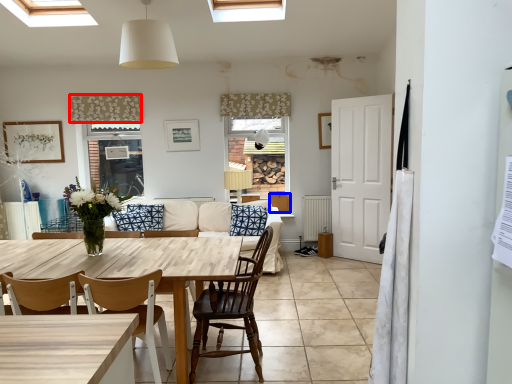
Question: Among these objects, which one is farthest to the camera, curtain (highlighted by a red box) or cabinetry (highlighted by a blue box)?

Choices:
 (A) curtain
 (B) cabinetry

Answer: (B)